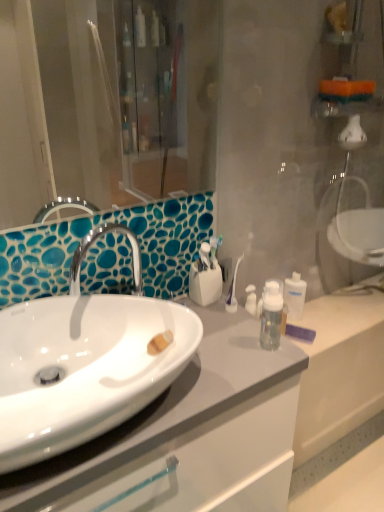
This screenshot has height=512, width=384. What do you see at coordinates (85, 362) in the screenshot?
I see `white glossy sink at center` at bounding box center [85, 362].

Locate an element on the screen. white glossy cabinet at center is located at coordinates (189, 434).

The width and height of the screenshot is (384, 512). What do you see at coordinates (294, 296) in the screenshot?
I see `clear plastic bottle at center-right` at bounding box center [294, 296].

Identify the location of white glossy sink at center. The width and height of the screenshot is (384, 512). point(85,362).

Which is more to the right, clear plastic bottle at center-right or white glossy cabinet at center?

Positioned to the right is clear plastic bottle at center-right.

Which is closer, (295, 294) or (155, 425)?

The point (155, 425) is in front.

Is clear plastic bottle at center-right far away from white glossy cabinet at center?

That's not correct — clear plastic bottle at center-right is a little close to white glossy cabinet at center.

Considering the sizes of objects clear plastic bottle at center-right and white glossy cabinet at center in the image provided, who is wider, clear plastic bottle at center-right or white glossy cabinet at center?

With larger width is white glossy cabinet at center.

Does white glossy sink at center appear on the left side of white glossy cabinet at center?

Yes.

Find the location of `sink on the left of the white glossy cabinet at center`. sink on the left of the white glossy cabinet at center is located at coordinates (85, 362).

From the image's perspective, which one is positioned lower, white glossy sink at center or white glossy cabinet at center?

white glossy cabinet at center appears lower in the image.

Does white glossy sink at center lie in front of white glossy cabinet at center?

Yes, white glossy sink at center is closer to the camera.

Considering the relative positions of white glossy sink at center and clear plastic bottle at center-right in the image provided, is white glossy sink at center to the left of clear plastic bottle at center-right from the viewer's perspective?

Correct, you'll find white glossy sink at center to the left of clear plastic bottle at center-right.

You are a GUI agent. You are given a task and a screenshot of the screen. Output one action in this format:
    pyautogui.click(x=<x>, y=<y>)
    Task: Click on the mouthwash located above the white glossy sink at center (from the image's perspective)
    
    Given the screenshot: What is the action you would take?
    pyautogui.click(x=294, y=296)

Which is closer, (25, 397) or (303, 291)?

The point (25, 397) is closer to the camera.

Is white glossy sink at center turned away from clear plastic bottle at center-right?

No, clear plastic bottle at center-right is not at the back of white glossy sink at center.

Can you confirm if clear plastic bottle at center-right is thinner than white glossy sink at center?

Indeed, clear plastic bottle at center-right has a lesser width compared to white glossy sink at center.

Is clear plastic bottle at center-right further to camera compared to white glossy sink at center?

Yes, it is.

Is clear plastic bottle at center-right aimed at white glossy sink at center?

No, clear plastic bottle at center-right is not oriented towards white glossy sink at center.

Is white glossy cabinet at center wider or thinner than white glossy sink at center?

Considering their sizes, white glossy cabinet at center looks broader than white glossy sink at center.

Is white glossy cabinet at center oriented towards white glossy sink at center?

No, white glossy cabinet at center is not aimed at white glossy sink at center.

This screenshot has height=512, width=384. What are the coordinates of `bathroom cabinet to the right of white glossy sink at center` in the screenshot? It's located at (189, 434).

From a real-world perspective, is white glossy cabinet at center below clear plastic bottle at center-right?

Yes.

Consider the image. Could you tell me if white glossy cabinet at center is facing clear plastic bottle at center-right?

No, white glossy cabinet at center does not turn towards clear plastic bottle at center-right.

Consider the image. Between white glossy cabinet at center and clear plastic bottle at center-right, which one has larger size?

Bigger between the two is white glossy cabinet at center.

From the picture: Which object is positioned more to the left, white glossy cabinet at center or clear plastic bottle at center-right?

From the viewer's perspective, white glossy cabinet at center appears more on the left side.

Locate an element on the screen. mouthwash on the right of white glossy cabinet at center is located at coordinates (294, 296).

Image resolution: width=384 pixels, height=512 pixels. In order to click on bathroom cabinet located underneath the white glossy sink at center (from a real-world perspective) in this screenshot , I will do `click(189, 434)`.

From the image, which object appears to be farther from clear plastic bottle at center-right, white glossy cabinet at center or white glossy sink at center?

Based on the image, white glossy sink at center appears to be further to clear plastic bottle at center-right.

When comparing their distances from clear plastic bottle at center-right, does white glossy sink at center or white glossy cabinet at center seem closer?

Based on the image, white glossy cabinet at center appears to be nearer to clear plastic bottle at center-right.

From the image, which object appears to be farther from white glossy sink at center, white glossy cabinet at center or clear plastic bottle at center-right?

clear plastic bottle at center-right lies further to white glossy sink at center than the other object.

Estimate the real-world distances between objects in this image. Which object is further from white glossy sink at center, clear plastic bottle at center-right or white glossy cabinet at center?

clear plastic bottle at center-right lies further to white glossy sink at center than the other object.

Which object lies nearer to the anchor point white glossy cabinet at center, clear plastic bottle at center-right or white glossy sink at center?

The object closer to white glossy cabinet at center is white glossy sink at center.

Based on their spatial positions, is white glossy sink at center or clear plastic bottle at center-right further from white glossy cabinet at center?

clear plastic bottle at center-right lies further to white glossy cabinet at center than the other object.

The width and height of the screenshot is (384, 512). Find the location of `bathroom cabinet between white glossy sink at center and clear plastic bottle at center-right from front to back`. bathroom cabinet between white glossy sink at center and clear plastic bottle at center-right from front to back is located at coordinates (189, 434).